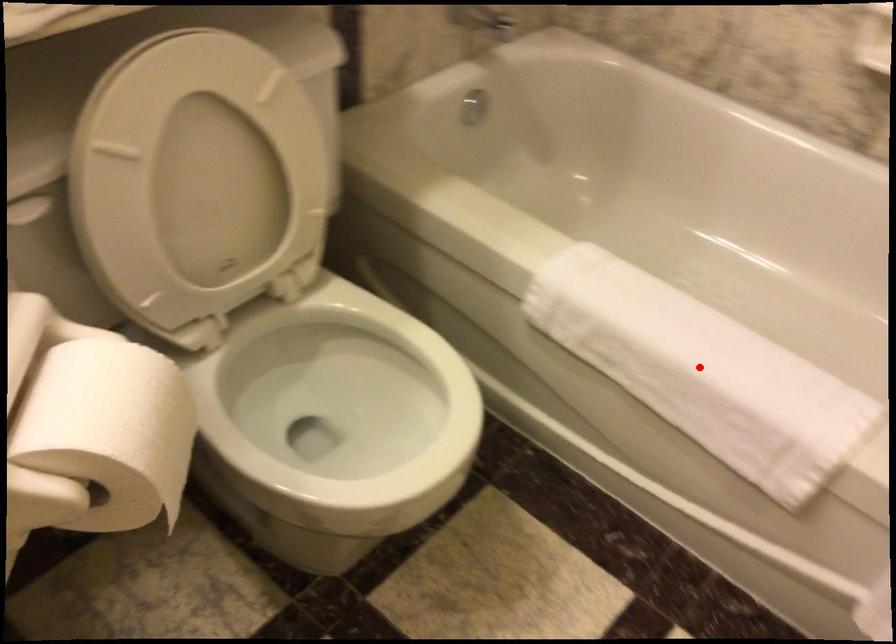
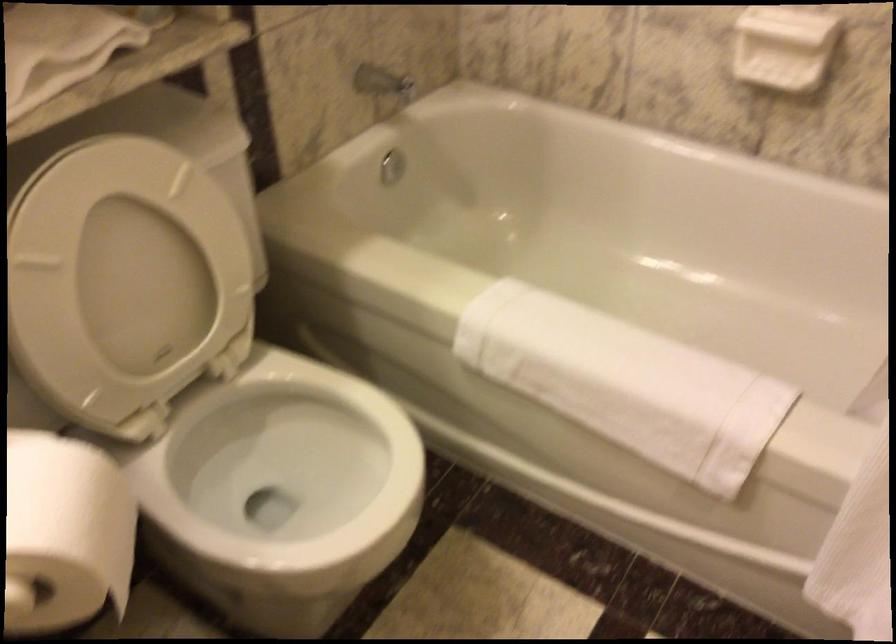
The point at the highlighted location is marked in the first image. Where is the corresponding point in the second image?

(625, 383)